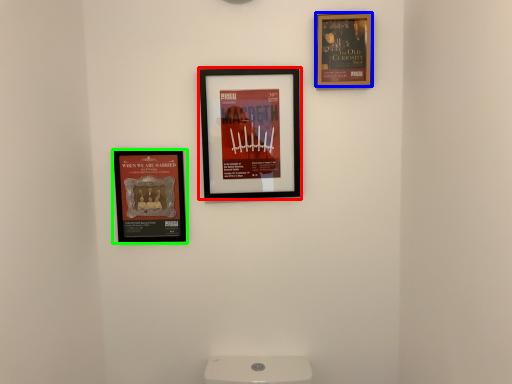
Question: Which object is the farthest from picture frame (highlighted by a red box)? Choose among these: picture frame (highlighted by a blue box) or picture frame (highlighted by a green box).

Choices:
 (A) picture frame
 (B) picture frame

Answer: (A)